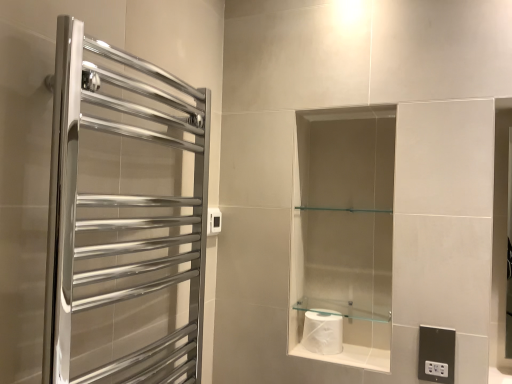
Question: Would you say polished chrome towel rack at left is outside black plastic electrical outlet at lower right, the 1th electric outlet in the bottom-to-top sequence?

Choices:
 (A) yes
 (B) no

Answer: (A)

Question: Can you confirm if polished chrome towel rack at left is shorter than black plastic electrical outlet at lower right, the second electric outlet in the top-to-bottom sequence?

Choices:
 (A) no
 (B) yes

Answer: (A)

Question: Does polished chrome towel rack at left have a smaller size compared to black plastic electrical outlet at lower right, which ranks as the 1th electric outlet in right-to-left order?

Choices:
 (A) no
 (B) yes

Answer: (A)

Question: Is polished chrome towel rack at left not close to black plastic electrical outlet at lower right, the second electric outlet in the top-to-bottom sequence?

Choices:
 (A) yes
 (B) no

Answer: (B)

Question: From the image's perspective, is polished chrome towel rack at left located beneath black plastic electrical outlet at lower right, the second electric outlet in the top-to-bottom sequence?

Choices:
 (A) yes
 (B) no

Answer: (B)

Question: Is the position of polished chrome towel rack at left less distant than that of black plastic electrical outlet at lower right, the second electric outlet in the top-to-bottom sequence?

Choices:
 (A) no
 (B) yes

Answer: (B)

Question: Are polished chrome towel rack at left and white plastic electric outlet at upper center, the 2th electric outlet from the right, far apart?

Choices:
 (A) no
 (B) yes

Answer: (A)

Question: From the image's perspective, is polished chrome towel rack at left beneath white plastic electric outlet at upper center, the 2th electric outlet from the right?

Choices:
 (A) no
 (B) yes

Answer: (B)

Question: Does polished chrome towel rack at left contain white plastic electric outlet at upper center, the second electric outlet when ordered from bottom to top?

Choices:
 (A) no
 (B) yes

Answer: (A)

Question: Is polished chrome towel rack at left further to camera compared to white plastic electric outlet at upper center, placed as the 2th electric outlet when sorted from front to back?

Choices:
 (A) yes
 (B) no

Answer: (B)

Question: Is polished chrome towel rack at left thinner than white plastic electric outlet at upper center, the 2th electric outlet from the right?

Choices:
 (A) no
 (B) yes

Answer: (A)

Question: Can you confirm if polished chrome towel rack at left is taller than white plastic electric outlet at upper center, placed as the 2th electric outlet when sorted from front to back?

Choices:
 (A) yes
 (B) no

Answer: (A)

Question: Considering the relative sizes of polished chrome towel rack at left and white glossy toilet paper at lower center in the image provided, is polished chrome towel rack at left thinner than white glossy toilet paper at lower center?

Choices:
 (A) no
 (B) yes

Answer: (B)